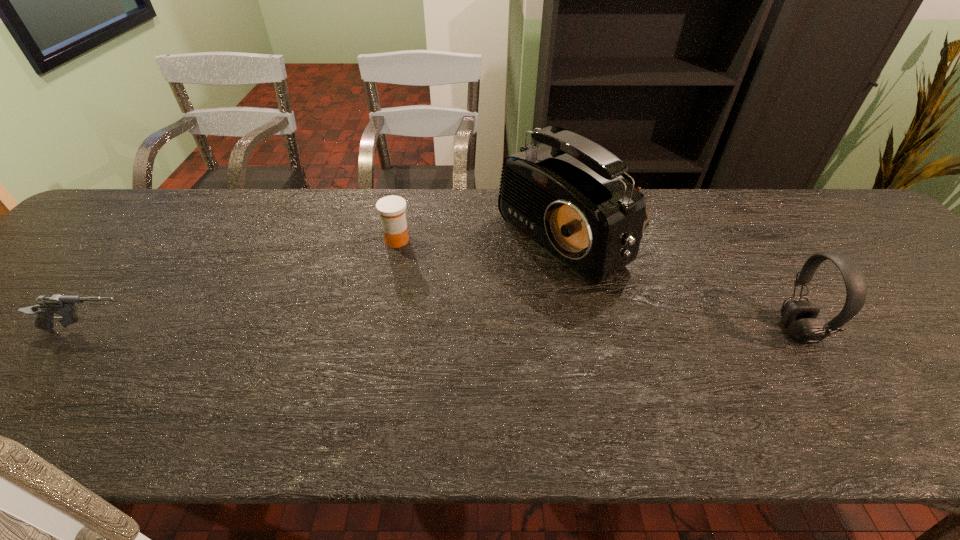
Find the location of `vacant region at the left edge of the desktop`. vacant region at the left edge of the desktop is located at coordinates (40, 281).

The height and width of the screenshot is (540, 960). In order to click on free space at the far left corner of the desktop in this screenshot , I will do `click(117, 202)`.

Image resolution: width=960 pixels, height=540 pixels. In order to click on free spot at the far right corner of the desktop in this screenshot , I will do `click(828, 213)`.

The height and width of the screenshot is (540, 960). I want to click on unoccupied area between the second object from left to right and the gun, so click(244, 286).

I want to click on free point between the third shortest object and the second object from left to right, so click(597, 286).

The image size is (960, 540). I want to click on vacant area that lies between the radio receiver and the medicine, so click(488, 239).

Where is `vacant area between the leftmost object and the medicine`? This screenshot has height=540, width=960. vacant area between the leftmost object and the medicine is located at coordinates (244, 286).

At what (x,y) coordinates should I click in order to perform the action: click on empty space that is in between the leftmost object and the radio receiver. Please return your answer as a coordinate pair (x, y). The height and width of the screenshot is (540, 960). Looking at the image, I should click on (334, 284).

Find the location of a particular element. The height and width of the screenshot is (540, 960). empty space between the third object from right to left and the second tallest object is located at coordinates (597, 286).

The height and width of the screenshot is (540, 960). Find the location of `vacant area that lies between the third object from left to right and the leftmost object`. vacant area that lies between the third object from left to right and the leftmost object is located at coordinates (334, 284).